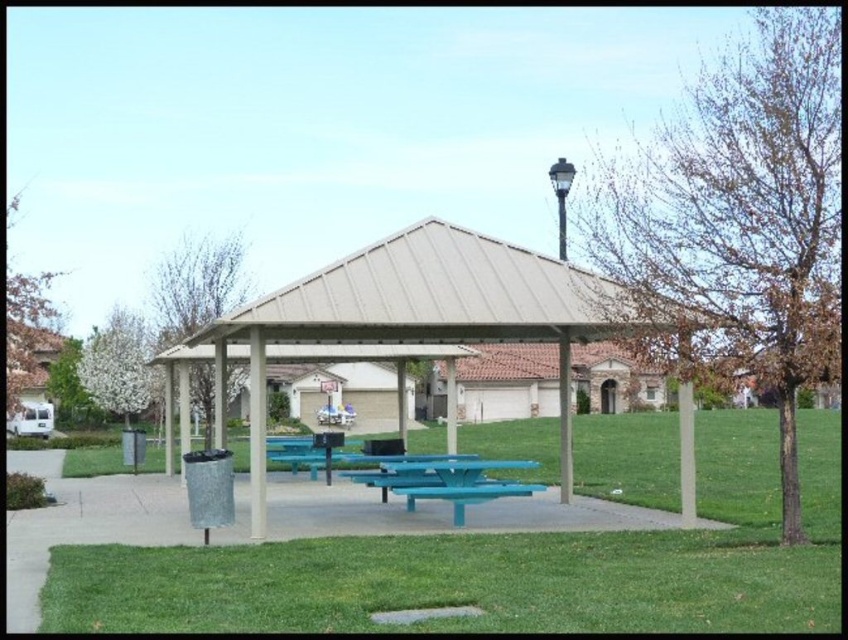
Question: Based on their relative distances, which object is farther from the green leafy tree at left?

Choices:
 (A) green grass at center
 (B) brown textured tree at center
 (C) white blossoming tree at upper left
 (D) brown leafy tree at upper left

Answer: (B)

Question: Can you confirm if green grass at lower center is thinner than tan/wooden picnic shelter at center?

Choices:
 (A) yes
 (B) no

Answer: (A)

Question: Is the position of bare branches at upper left more distant than that of teal glossy picnic table at center?

Choices:
 (A) no
 (B) yes

Answer: (B)

Question: Does green grass at center have a larger size compared to brown textured tree at center?

Choices:
 (A) yes
 (B) no

Answer: (B)

Question: Which point appears farthest from the camera in this image?

Choices:
 (A) (143, 346)
 (B) (113, 616)
 (C) (466, 488)
 (D) (152, 292)

Answer: (D)

Question: Which of the following is the closest to the observer?

Choices:
 (A) (116, 381)
 (B) (530, 486)
 (C) (85, 417)

Answer: (B)